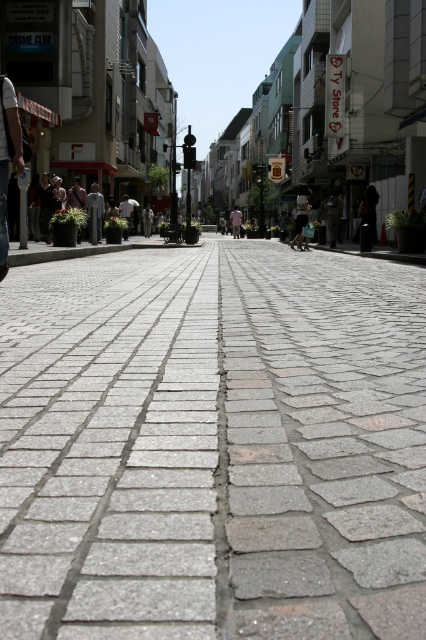
Question: Does gray cobblestone pavement at center have a smaller size compared to light blue denim jacket at center?

Choices:
 (A) yes
 (B) no

Answer: (A)

Question: Considering the relative positions of gray cobblestone pavement at center and light blue denim jacket at center in the image provided, where is gray cobblestone pavement at center located with respect to light blue denim jacket at center?

Choices:
 (A) below
 (B) above

Answer: (A)

Question: Which point appears closest to the camera in this image?

Choices:
 (A) tap(299, 266)
 (B) tap(236, 232)

Answer: (A)

Question: Which point is farther from the camera taking this photo?

Choices:
 (A) coord(236,230)
 (B) coord(296,211)

Answer: (A)

Question: Is gray cobblestone pavement at center in front of light blue denim jacket at center?

Choices:
 (A) no
 (B) yes

Answer: (B)

Question: Which point is closer to the camera taking this photo?

Choices:
 (A) (238, 227)
 (B) (218, 500)

Answer: (B)